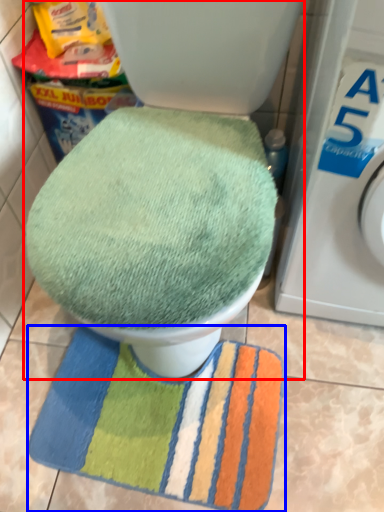
Question: Which of the following is the closest to the observer, toilet (highlighted by a red box) or beach towel (highlighted by a blue box)?

Choices:
 (A) toilet
 (B) beach towel

Answer: (A)